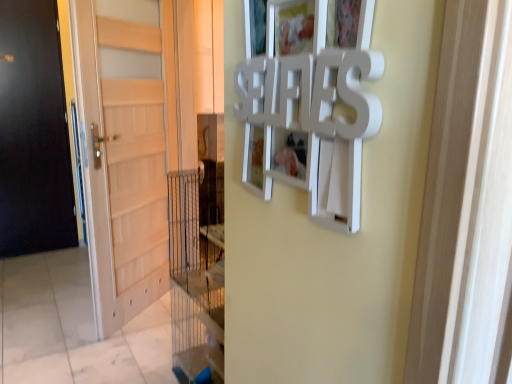
Find the location of a particular element. matte wood door at left is located at coordinates (125, 150).

The height and width of the screenshot is (384, 512). What do you see at coordinates (125, 150) in the screenshot?
I see `matte wood door at left` at bounding box center [125, 150].

Identify the location of white matte picture frame at upper center. The width and height of the screenshot is (512, 384). (311, 102).

Describe the element at coordinates (311, 102) in the screenshot. I see `white matte picture frame at upper center` at that location.

I want to click on matte wood door at left, so click(125, 150).

In the image, is matte wood door at left on the left side or the right side of white matte picture frame at upper center?

In the image, matte wood door at left appears on the left side of white matte picture frame at upper center.

Considering the relative positions of matte wood door at left and white matte picture frame at upper center in the image provided, is matte wood door at left behind white matte picture frame at upper center?

Yes, matte wood door at left is further from the viewer.

Which is behind, point (116, 267) or point (258, 76)?

The point (116, 267) is farther from the camera.

From the image's perspective, would you say matte wood door at left is positioned over white matte picture frame at upper center?

No, from the image's perspective, matte wood door at left is not over white matte picture frame at upper center.

From a real-world perspective, does matte wood door at left stand above white matte picture frame at upper center?

No.

Between matte wood door at left and white matte picture frame at upper center, which one has larger width?

With larger width is matte wood door at left.

Considering the sizes of objects matte wood door at left and white matte picture frame at upper center in the image provided, who is shorter, matte wood door at left or white matte picture frame at upper center?

white matte picture frame at upper center.

Considering the sizes of objects matte wood door at left and white matte picture frame at upper center in the image provided, who is smaller, matte wood door at left or white matte picture frame at upper center?

white matte picture frame at upper center is smaller.

Is matte wood door at left outside of white matte picture frame at upper center?

Absolutely, matte wood door at left is external to white matte picture frame at upper center.

Consider the image. Is matte wood door at left in contact with white matte picture frame at upper center?

matte wood door at left is not next to white matte picture frame at upper center, and they're not touching.

Is matte wood door at left oriented towards white matte picture frame at upper center?

No.

Image resolution: width=512 pixels, height=384 pixels. What are the coordinates of `door lying on the left of white matte picture frame at upper center` in the screenshot? It's located at (125, 150).

Visually, is white matte picture frame at upper center positioned to the left or to the right of matte wood door at left?

Based on their positions, white matte picture frame at upper center is located to the right of matte wood door at left.

Which is in front, white matte picture frame at upper center or matte wood door at left?

white matte picture frame at upper center is more forward.

Which is closer to the camera, (293, 130) or (90, 256)?

The point (293, 130) is in front.

From the image's perspective, is white matte picture frame at upper center above matte wood door at left?

Indeed, from the image's perspective, white matte picture frame at upper center is shown above matte wood door at left.

From a real-world perspective, which object rests below the other?

In real-world perspective, matte wood door at left is lower.

Can you confirm if white matte picture frame at upper center is wider than matte wood door at left?

In fact, white matte picture frame at upper center might be narrower than matte wood door at left.

Considering the sizes of objects white matte picture frame at upper center and matte wood door at left in the image provided, who is taller, white matte picture frame at upper center or matte wood door at left?

With more height is matte wood door at left.

Looking at this image, between white matte picture frame at upper center and matte wood door at left, which one has larger size?

Bigger between the two is matte wood door at left.

Is white matte picture frame at upper center not within matte wood door at left?

white matte picture frame at upper center lies outside matte wood door at left's area.

Is white matte picture frame at upper center directly adjacent to matte wood door at left?

white matte picture frame at upper center is not next to matte wood door at left, and they're not touching.

Is matte wood door at left at the back of white matte picture frame at upper center?

white matte picture frame at upper center is not turned away from matte wood door at left.

How much distance is there between white matte picture frame at upper center and matte wood door at left?

The distance of white matte picture frame at upper center from matte wood door at left is 1.62 meters.

Where is `picture frame above the matte wood door at left (from the image's perspective)`? The image size is (512, 384). picture frame above the matte wood door at left (from the image's perspective) is located at coordinates (311, 102).

Identify the location of door behind the white matte picture frame at upper center. The image size is (512, 384). (125, 150).

Identify the location of picture frame on the right of the matte wood door at left. (311, 102).